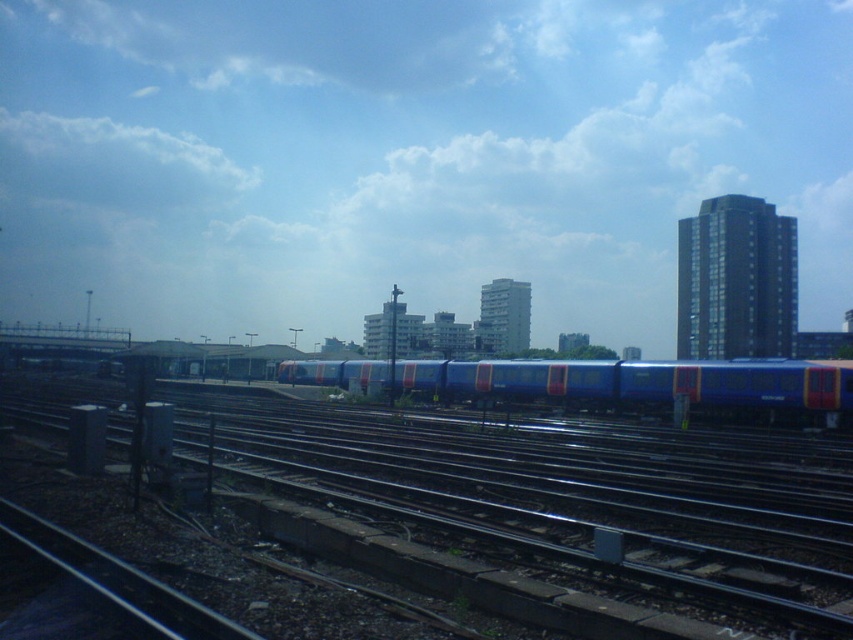
Question: Does metallic tracks at center appear on the right side of blue metallic train at center?

Choices:
 (A) yes
 (B) no

Answer: (B)

Question: Is metallic tracks at center smaller than blue metallic train at center?

Choices:
 (A) yes
 (B) no

Answer: (B)

Question: Which point is closer to the camera taking this photo?

Choices:
 (A) (764, 364)
 (B) (561, 573)

Answer: (B)

Question: Can you confirm if metallic tracks at center is positioned above blue metallic train at center?

Choices:
 (A) yes
 (B) no

Answer: (B)